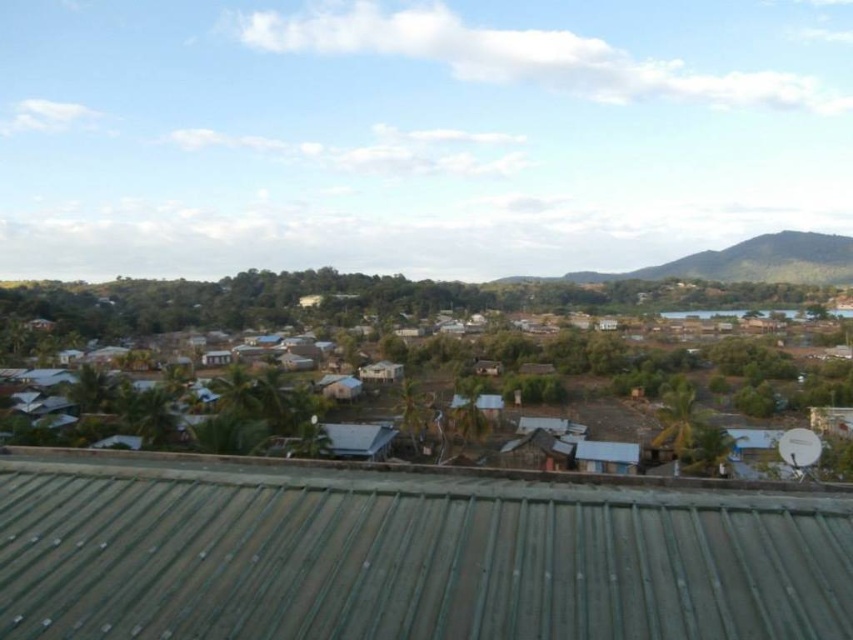
Question: Which object is closer to the camera taking this photo?

Choices:
 (A) metallic roofs at center
 (B) green textured hill at upper right
 (C) green corrugated metal roof at center

Answer: (C)

Question: Where is metallic roofs at center located in relation to green textured hill at upper right in the image?

Choices:
 (A) right
 (B) left

Answer: (B)

Question: Which point is farther from the camera taking this photo?

Choices:
 (A) (729, 298)
 (B) (643, 525)
 (C) (538, 276)

Answer: (C)

Question: Which object appears closest to the camera in this image?

Choices:
 (A) green textured hill at upper right
 (B) green corrugated metal roof at center

Answer: (B)

Question: Does green corrugated metal roof at center appear on the left side of metallic roofs at center?

Choices:
 (A) yes
 (B) no

Answer: (A)

Question: Can you confirm if metallic roofs at center is bigger than green textured hill at upper right?

Choices:
 (A) no
 (B) yes

Answer: (B)